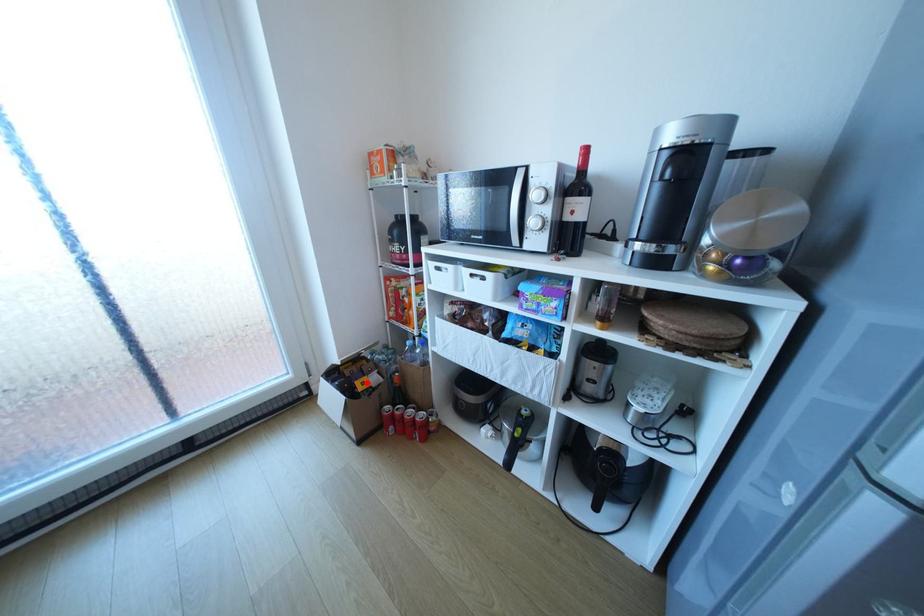
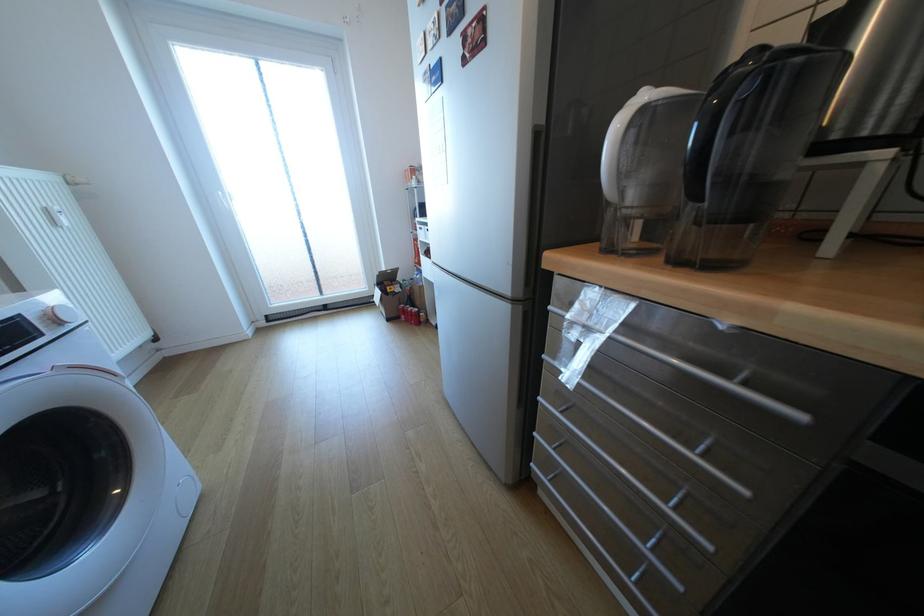
Question: I am providing you with two images of the same scene from different viewpoints. A red point is shown in image1. For the corresponding object point in image2, is it positioned nearer or farther from the camera?

Choices:
 (A) Nearer
 (B) Farther

Answer: (A)